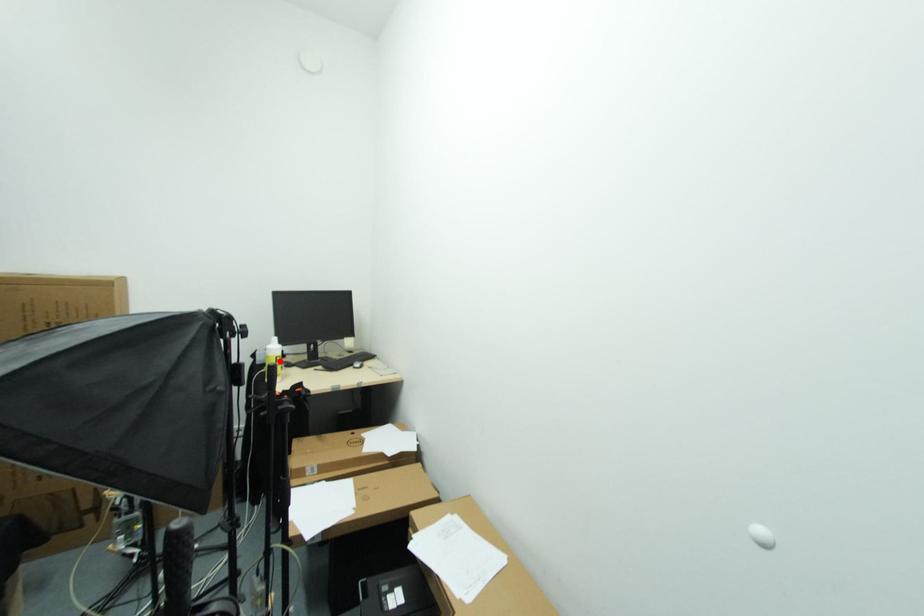
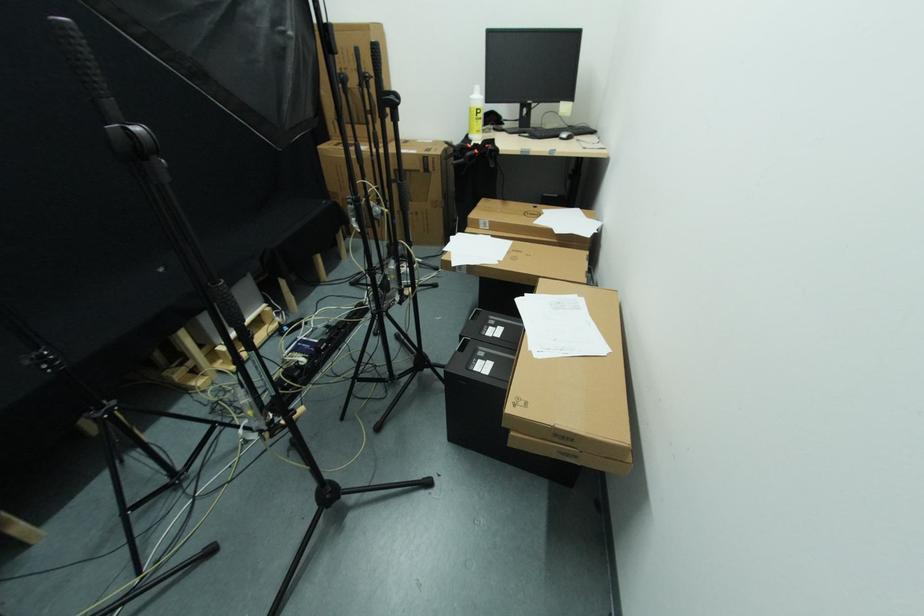
Locate, in the second image, the point that corresponds to the highlighted location in the first image.

(481, 114)